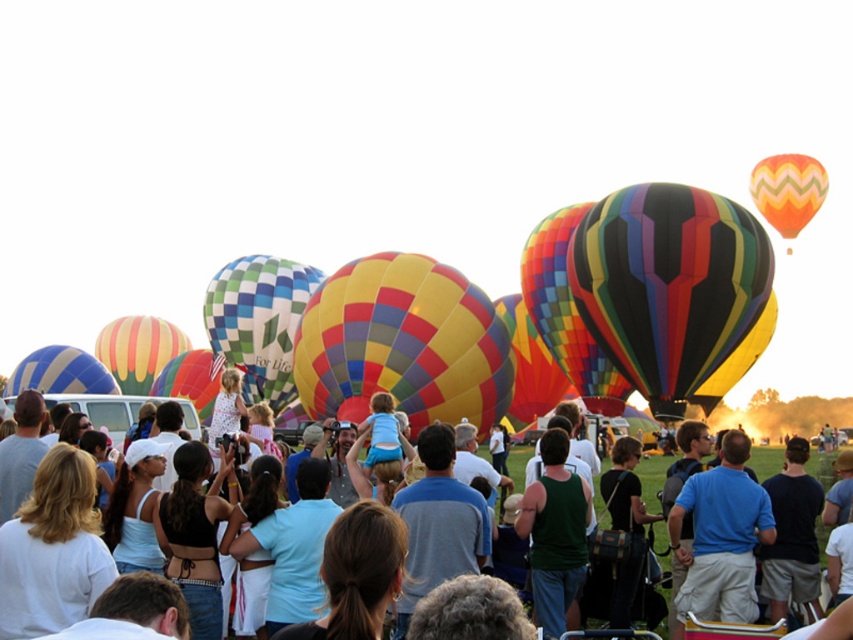
Question: Which object is positioned farthest from the orange zigzag fabric balloon at upper right?

Choices:
 (A) yellow and red striped fabric hot air balloon at center
 (B) multicolored fabric hot air balloon at center
 (C) matte multicolored balloons at center
 (D) multicolored striped fabric hot air balloon at center

Answer: (A)

Question: Is multicolored fabric hot air balloon at center above matte multicolored balloons at center?

Choices:
 (A) yes
 (B) no

Answer: (A)

Question: Which point is closer to the camera taking this photo?

Choices:
 (A) (651, 237)
 (B) (105, 396)
 (C) (747, 406)
 (D) (465, 381)

Answer: (A)

Question: Does yellow and red striped fabric hot air balloon at center appear under orange zigzag fabric balloon at upper right?

Choices:
 (A) no
 (B) yes

Answer: (B)

Question: Considering the relative positions of yellow and red striped fabric hot air balloon at center and orange zigzag fabric balloon at upper right in the image provided, where is yellow and red striped fabric hot air balloon at center located with respect to orange zigzag fabric balloon at upper right?

Choices:
 (A) left
 (B) right

Answer: (A)

Question: Which point is closer to the camera?

Choices:
 (A) (778, 198)
 (B) (759, 392)
 (C) (799, 400)
 (D) (701, 362)

Answer: (D)